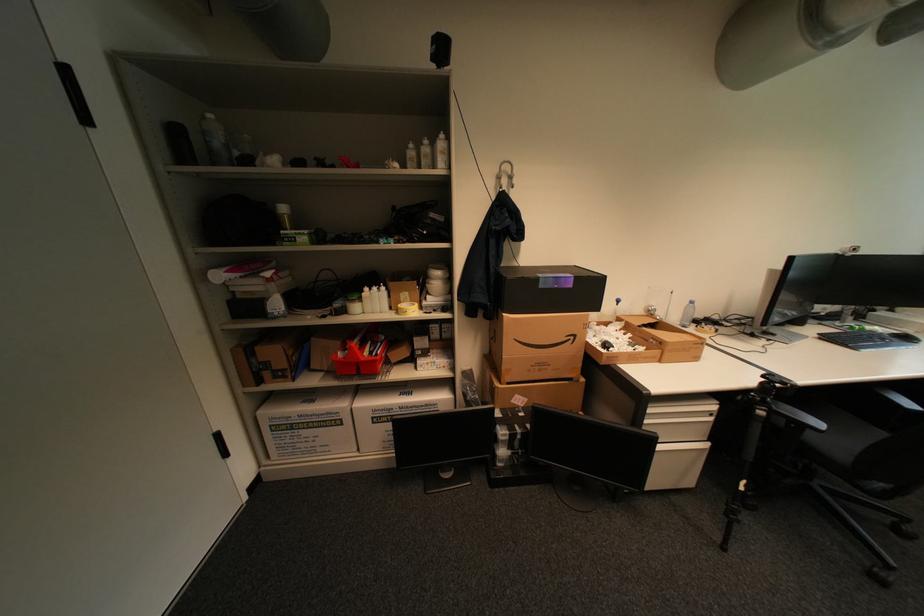
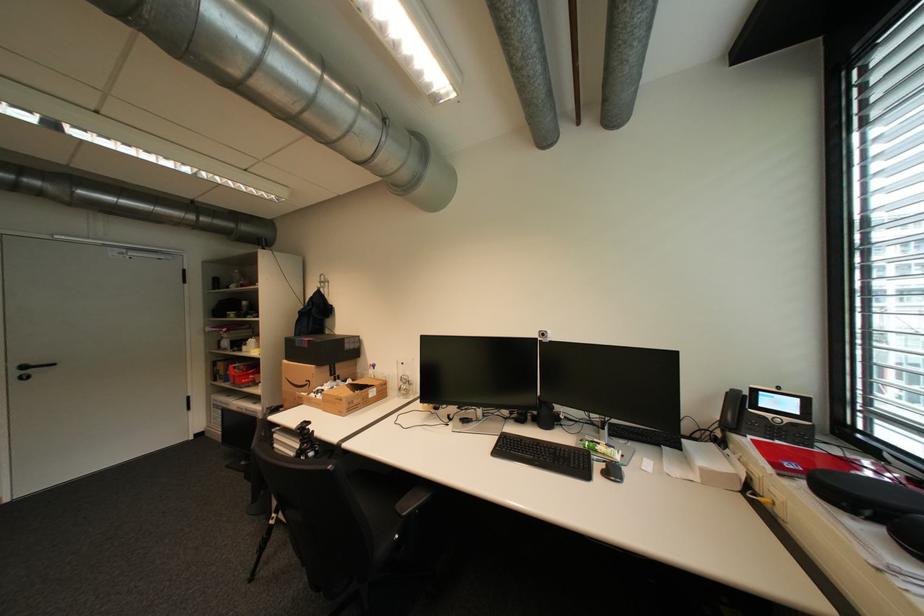
The point at (580, 338) is marked in the first image. Where is the corresponding point in the second image?

(317, 383)